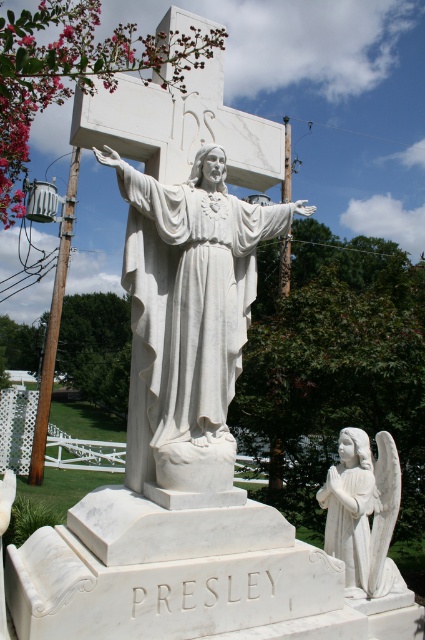
Question: Is white marble statue at center below white marble angel at lower right?

Choices:
 (A) no
 (B) yes

Answer: (A)

Question: Is white marble statue at center to the right of white marble angel at lower right from the viewer's perspective?

Choices:
 (A) no
 (B) yes

Answer: (A)

Question: Which point is farther from the camera taking this photo?

Choices:
 (A) (399, 481)
 (B) (195, 218)

Answer: (A)

Question: Can you confirm if white marble statue at center is smaller than white marble angel at lower right?

Choices:
 (A) yes
 (B) no

Answer: (B)

Question: Which of the following is the farthest from the observer?

Choices:
 (A) white marble statue at center
 (B) white marble angel at lower right

Answer: (B)